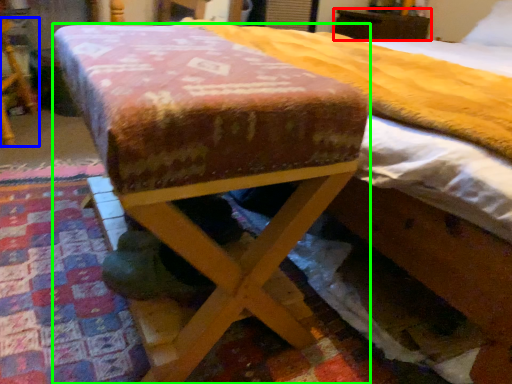
Question: Based on their relative distances, which object is nearer to furniture (highlighted by a red box)? Choose from furniture (highlighted by a blue box) and furniture (highlighted by a green box).

Choices:
 (A) furniture
 (B) furniture

Answer: (A)